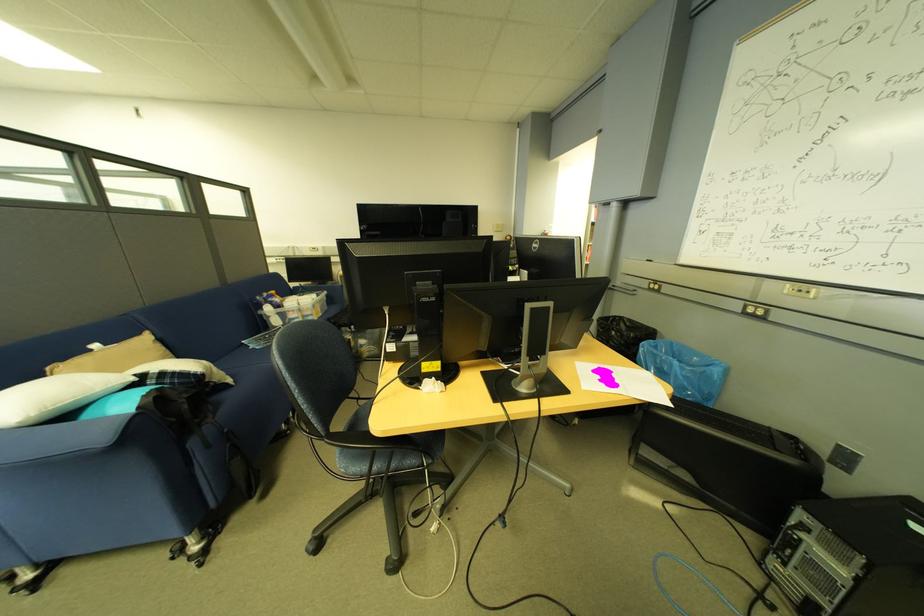
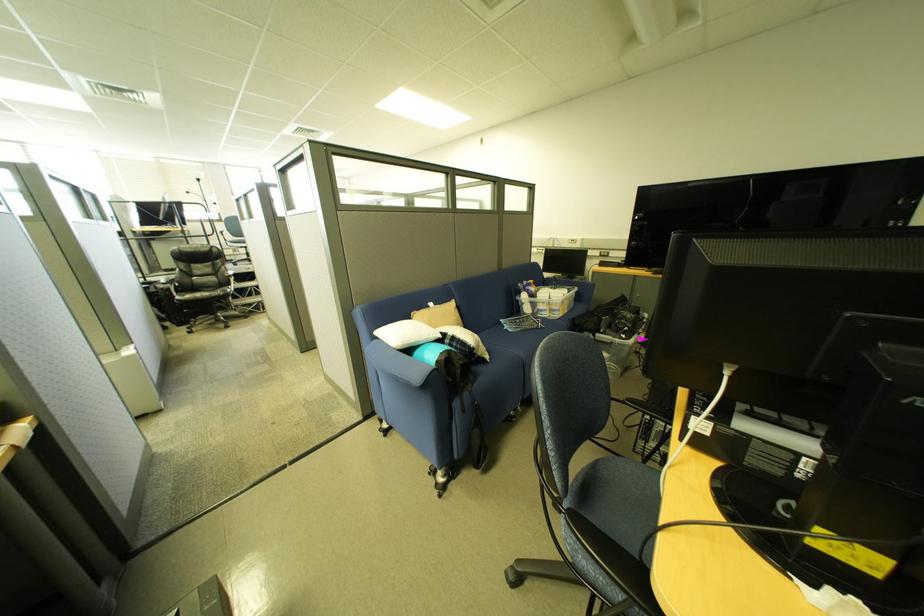
In the second image, find the point that corresponds to [185,376] in the first image.

(469, 342)